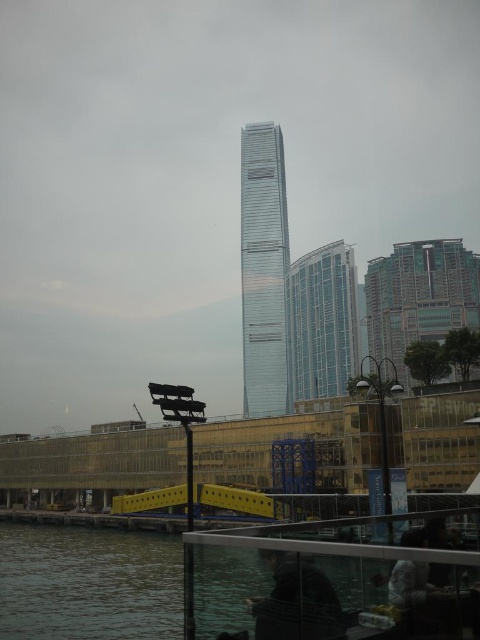
Question: Estimate the real-world distances between objects in this image. Which object is farther from the clear water at lower left?

Choices:
 (A) dark gray fabric jacket at lower center
 (B) metallic glass building at right
 (C) transparent glass skyscraper at center

Answer: (B)

Question: From the image, what is the correct spatial relationship of transparent glass skyscraper at center in relation to metallic glass building at right?

Choices:
 (A) below
 (B) above

Answer: (A)

Question: From the image, what is the correct spatial relationship of metallic glass building at right in relation to clear glass building at center?

Choices:
 (A) below
 (B) above

Answer: (B)

Question: Which point is farther to the camera?

Choices:
 (A) clear water at lower left
 (B) clear glass building at center
 (C) metallic glass building at right

Answer: (B)

Question: Which of the following is the closest to the observer?

Choices:
 (A) dark gray fabric jacket at lower center
 (B) transparent glass skyscraper at center

Answer: (A)

Question: Can you confirm if clear water at lower left is bigger than clear glass building at center?

Choices:
 (A) no
 (B) yes

Answer: (A)